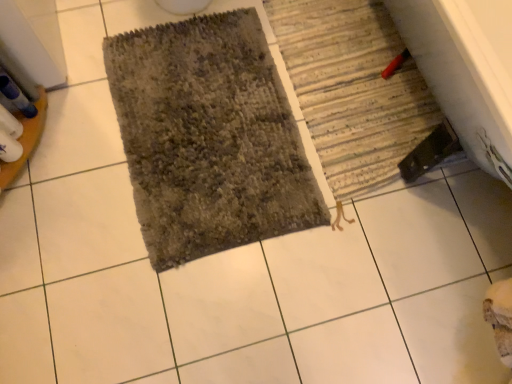
Question: Can you confirm if striped fabric bath mat at lower right, which is the first bath mat in right-to-left order, is wider than textured gray bath mat at center, the 1th bath mat viewed from the left?

Choices:
 (A) yes
 (B) no

Answer: (B)

Question: Would you consider striped fabric bath mat at lower right, which is the first bath mat in right-to-left order, to be distant from textured gray bath mat at center, the 1th bath mat viewed from the left?

Choices:
 (A) yes
 (B) no

Answer: (B)

Question: Is striped fabric bath mat at lower right, which is the first bath mat in right-to-left order, at the left side of textured gray bath mat at center, the 1th bath mat viewed from the left?

Choices:
 (A) yes
 (B) no

Answer: (B)

Question: From the image's perspective, does striped fabric bath mat at lower right, which is the first bath mat in right-to-left order, appear lower than textured gray bath mat at center, which is the 2th bath mat in right-to-left order?

Choices:
 (A) no
 (B) yes

Answer: (A)

Question: Does striped fabric bath mat at lower right, the second bath mat viewed from the left, have a lesser width compared to textured gray bath mat at center, which is the 2th bath mat in right-to-left order?

Choices:
 (A) yes
 (B) no

Answer: (A)

Question: From the image's perspective, is striped fabric bath mat at lower right, which is the first bath mat in right-to-left order, over textured gray bath mat at center, the 1th bath mat viewed from the left?

Choices:
 (A) yes
 (B) no

Answer: (A)

Question: Is striped fabric bath mat at lower right, the second bath mat viewed from the left, a part of textured gray bath mat at center, which is the 2th bath mat in right-to-left order?

Choices:
 (A) no
 (B) yes

Answer: (A)

Question: Considering the relative sizes of textured gray bath mat at center, which is the 2th bath mat in right-to-left order, and striped fabric bath mat at lower right, which is the first bath mat in right-to-left order, in the image provided, is textured gray bath mat at center, which is the 2th bath mat in right-to-left order, smaller than striped fabric bath mat at lower right, which is the first bath mat in right-to-left order,?

Choices:
 (A) no
 (B) yes

Answer: (A)

Question: Is textured gray bath mat at center, which is the 2th bath mat in right-to-left order, beside striped fabric bath mat at lower right, which is the first bath mat in right-to-left order?

Choices:
 (A) no
 (B) yes

Answer: (A)

Question: Does textured gray bath mat at center, the 1th bath mat viewed from the left, lie behind striped fabric bath mat at lower right, the second bath mat viewed from the left?

Choices:
 (A) no
 (B) yes

Answer: (A)

Question: Does textured gray bath mat at center, which is the 2th bath mat in right-to-left order, have a larger size compared to striped fabric bath mat at lower right, which is the first bath mat in right-to-left order?

Choices:
 (A) yes
 (B) no

Answer: (A)

Question: Considering the relative positions of textured gray bath mat at center, the 1th bath mat viewed from the left, and striped fabric bath mat at lower right, the second bath mat viewed from the left, in the image provided, is textured gray bath mat at center, the 1th bath mat viewed from the left, to the left of striped fabric bath mat at lower right, the second bath mat viewed from the left, from the viewer's perspective?

Choices:
 (A) yes
 (B) no

Answer: (A)

Question: Choose the correct answer: Is striped fabric bath mat at lower right, the second bath mat viewed from the left, inside textured gray bath mat at center, which is the 2th bath mat in right-to-left order, or outside it?

Choices:
 (A) inside
 (B) outside

Answer: (B)